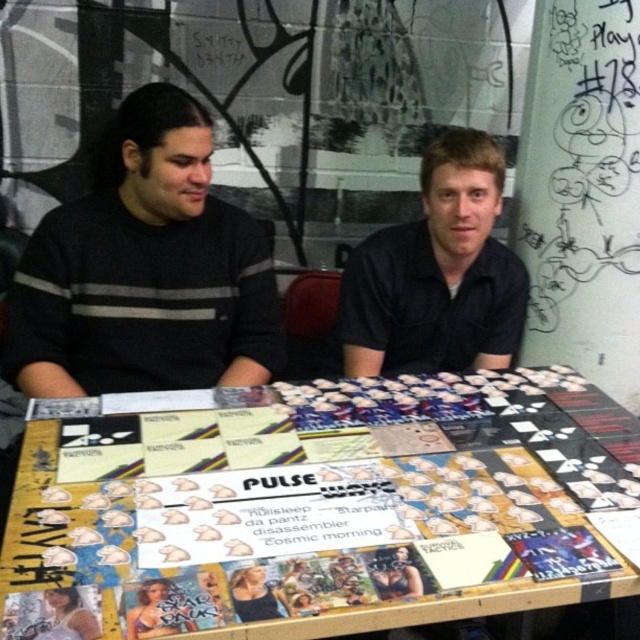
Consider the image. You are a photographer setting up for a portrait. You need to ensure both the black striped sweater at left and the black matte shirt at center are in focus. Which object should you focus on first to ensure depth of field covers both?

You should focus on the black striped sweater at left first since it is closer to the viewer, allowing the depth of field to extend backward to include the black matte shirt at center.

You are trying to place a small decorative item on the table between the wooden board game at center and the black striped sweater at left. Based on their heights, which object should the item be placed closer to?

The wooden board game at center has a lesser height compared to the black striped sweater at left, so the item should be placed closer to the wooden board game at center to ensure stability.

You are a delivery robot with a package that is 18 inches long. You need to place it between the wooden board game at center and the black striped sweater at left. Is there enough space?

The distance between the wooden board game at center and the black striped sweater at left is 17.71 inches, which is less than the package length of 18 inches. Therefore, there is not enough space to place the package between them.